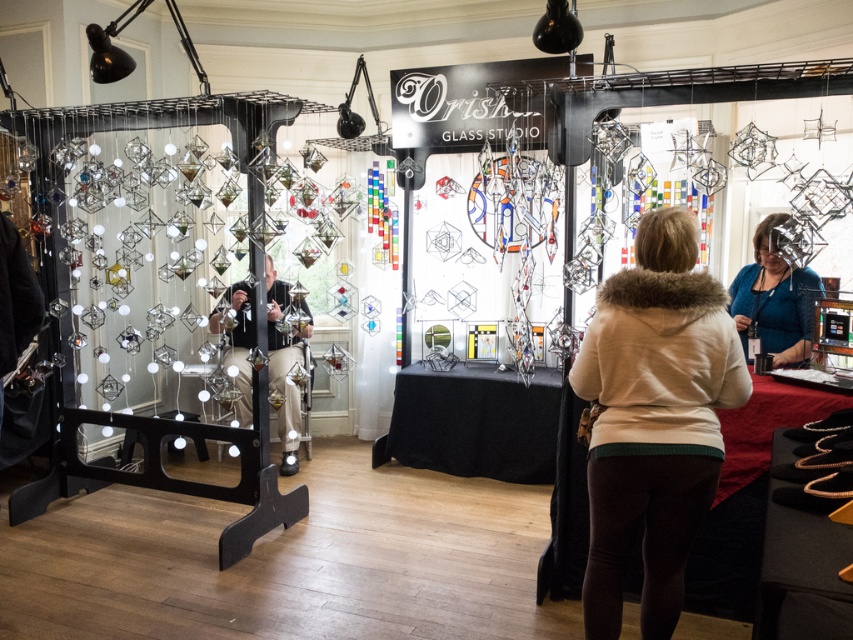
You are a photographer at the Orish Glass Studio exhibition. You want to capture a photo of the glass artworks displayed above while also including the black signboard in the frame. However, your matte black camera at center is blocking the view. Can you move the beige fur coat at center to the side to make space for the camera?

The beige fur coat at center is thinner than the matte black camera at center. Moving the beige fur coat at center to the side would free up space, but since the coat is thinner, it might not be sufficient to accommodate the camera. Consider moving the camera instead or adjusting its position for a better angle.

You are a photographer at the Orish Glass Studio exhibition. You need to take a photo of the glass artworks displayed above. There are two items in your way, a beige fur coat at center and a matte black camera at center. Which item do you need to move to get a clear shot of the glass artworks?

The beige fur coat at center is below the matte black camera at center, so you need to move the beige fur coat at center to get a clear shot of the glass artworks.